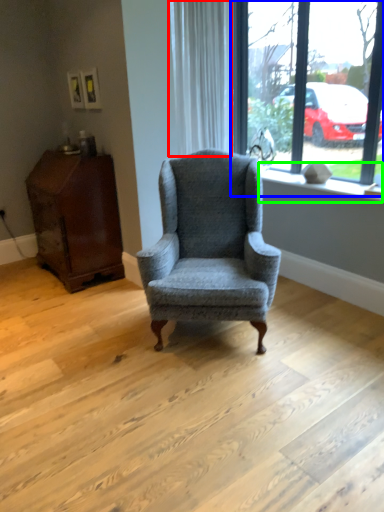
Question: Based on their relative distances, which object is farther from curtain (highlighted by a red box)? Choose from window (highlighted by a blue box) and window sill (highlighted by a green box).

Choices:
 (A) window
 (B) window sill

Answer: (B)